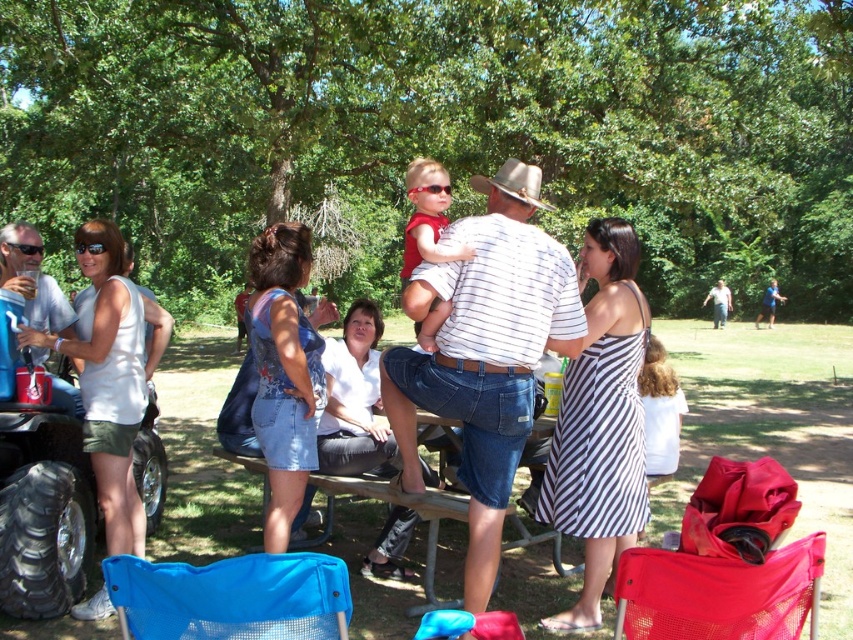
You are a photographer trying to capture a candid shot of the two people at the picnic table. You notice the black and white striped dress at center and the denim shorts at center. Which clothing item will appear larger in your photo?

The black and white striped dress at center will appear larger in the photo because it is closer to the viewer than the denim shorts at center.

You are a photographer trying to capture a candid shot of the black and white striped dress at center and the denim shorts at center. Which clothing item is closer to the camera?

The black and white striped dress at center is positioned under denim shorts at center, meaning it is closer to the camera.

You are standing at the picnic table and want to hand a drink to both the matte white shirt at center and the matte red shirt at center. Which person should you approach first based on their proximity to you?

You should approach the matte white shirt at center first because they are closer to you than the matte red shirt at center.